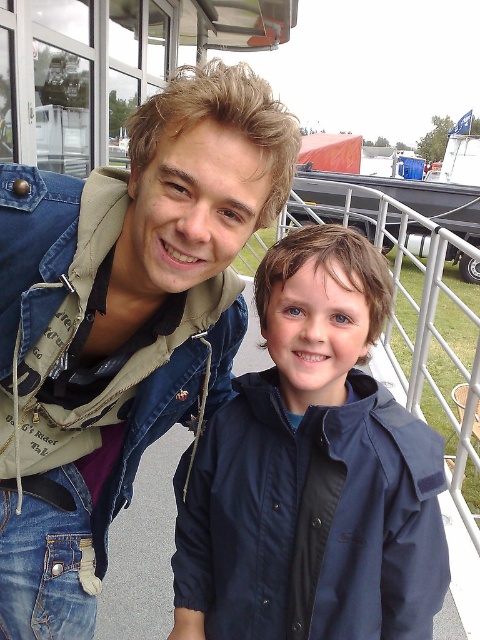
Please provide the 2D coordinates of the denim jacket at center in the image. The coordinates should be in the format of a tuple with two decimal numbers representing the x and y positions respectively.

The 2D coordinates of the denim jacket at center are at point (120,324).

You are a photographer trying to capture a photo of the two people wearing the denim jacket at center and the navy blue jacket at center. Since you want to focus on their upper bodies, which jacket should you adjust your camera to focus on first based on their vertical positions?

The denim jacket at center is located above the navy blue jacket at center, so you should focus on the denim jacket at center first as it is higher up.